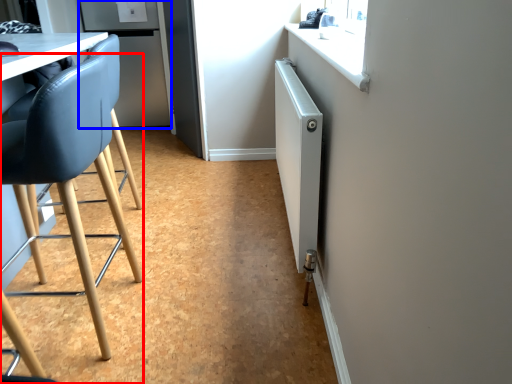
Question: Among these objects, which one is nearest to the camera, chair (highlighted by a red box) or fridge (highlighted by a blue box)?

Choices:
 (A) chair
 (B) fridge

Answer: (A)